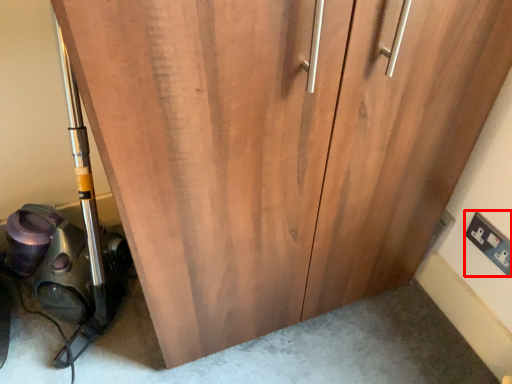
Question: From the image's perspective, where is electric outlet (annotated by the red box) located in relation to equipment in the image?

Choices:
 (A) below
 (B) above

Answer: (A)